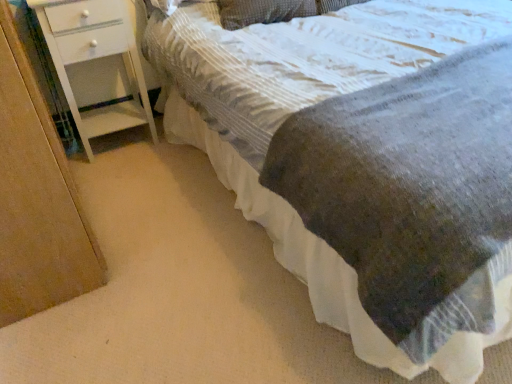
Question: Is textured gray pillow at upper center turned away from textured gray blanket at center?

Choices:
 (A) no
 (B) yes

Answer: (B)

Question: Is the depth of textured gray pillow at upper center greater than that of textured gray blanket at center?

Choices:
 (A) yes
 (B) no

Answer: (A)

Question: Can you confirm if textured gray pillow at upper center is shorter than textured gray blanket at center?

Choices:
 (A) yes
 (B) no

Answer: (A)

Question: Could you tell me if textured gray pillow at upper center is facing textured gray blanket at center?

Choices:
 (A) yes
 (B) no

Answer: (A)

Question: Is textured gray pillow at upper center bigger than textured gray blanket at center?

Choices:
 (A) no
 (B) yes

Answer: (A)

Question: Considering their positions, is textured gray pillow at upper center located in front of or behind white painted wood chest of drawers at left?

Choices:
 (A) front
 (B) behind

Answer: (B)

Question: Considering the positions of textured gray pillow at upper center and white painted wood chest of drawers at left in the image, is textured gray pillow at upper center bigger or smaller than white painted wood chest of drawers at left?

Choices:
 (A) small
 (B) big

Answer: (A)

Question: Is textured gray pillow at upper center taller or shorter than white painted wood chest of drawers at left?

Choices:
 (A) tall
 (B) short

Answer: (B)

Question: In terms of width, does textured gray pillow at upper center look wider or thinner when compared to white painted wood chest of drawers at left?

Choices:
 (A) thin
 (B) wide

Answer: (B)

Question: Is textured gray pillow at upper center inside the boundaries of textured gray blanket at center, or outside?

Choices:
 (A) inside
 (B) outside

Answer: (A)

Question: Is textured gray pillow at upper center wider or thinner than textured gray blanket at center?

Choices:
 (A) wide
 (B) thin

Answer: (B)

Question: From a real-world perspective, relative to textured gray blanket at center, is textured gray pillow at upper center vertically above or below?

Choices:
 (A) below
 (B) above

Answer: (B)

Question: From the image's perspective, relative to textured gray blanket at center, is textured gray pillow at upper center above or below?

Choices:
 (A) below
 (B) above

Answer: (B)

Question: From the image's perspective, is textured gray blanket at center located above or below white painted wood chest of drawers at left?

Choices:
 (A) above
 (B) below

Answer: (B)

Question: In terms of size, does textured gray blanket at center appear bigger or smaller than white painted wood chest of drawers at left?

Choices:
 (A) small
 (B) big

Answer: (B)